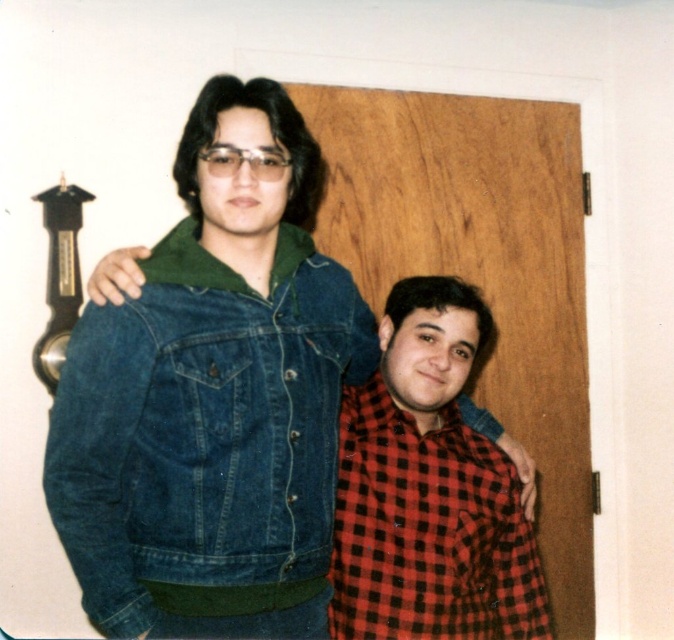
Question: Is denim jacket at upper left further to camera compared to red checkered shirt at lower right?

Choices:
 (A) no
 (B) yes

Answer: (A)

Question: Can you confirm if denim jacket at upper left is bigger than red checkered shirt at lower right?

Choices:
 (A) yes
 (B) no

Answer: (A)

Question: Which point is farther from the camera taking this photo?

Choices:
 (A) (158, 566)
 (B) (338, 627)

Answer: (B)

Question: Can you confirm if denim jacket at upper left is thinner than red checkered shirt at lower right?

Choices:
 (A) no
 (B) yes

Answer: (A)